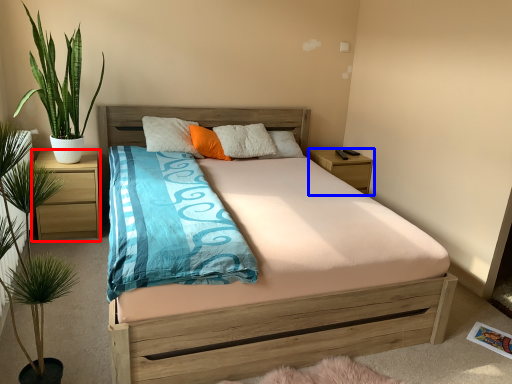
Question: Which object is further to the camera taking this photo, nightstand (highlighted by a red box) or nightstand (highlighted by a blue box)?

Choices:
 (A) nightstand
 (B) nightstand

Answer: (B)